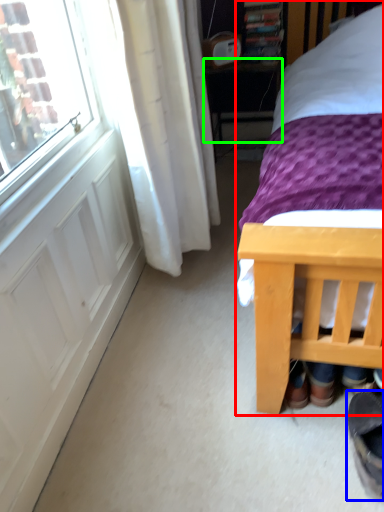
Question: Estimate the real-world distances between objects in this image. Which object is closer to bed (highlighted by a red box), footwear (highlighted by a blue box) or table (highlighted by a green box)?

Choices:
 (A) footwear
 (B) table

Answer: (A)